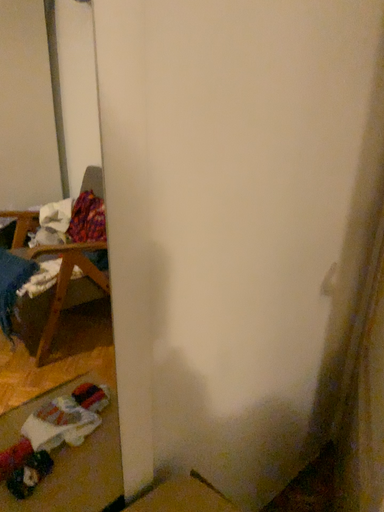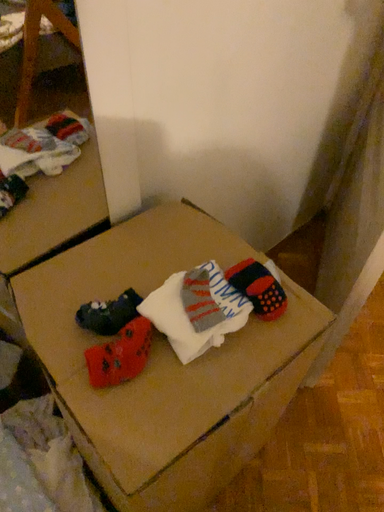
Question: How did the camera likely rotate when shooting the video?

Choices:
 (A) rotated downward
 (B) rotated upward

Answer: (A)